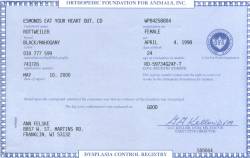
I want to click on bottom border - checkered patten (blue and white), so click(x=54, y=154).